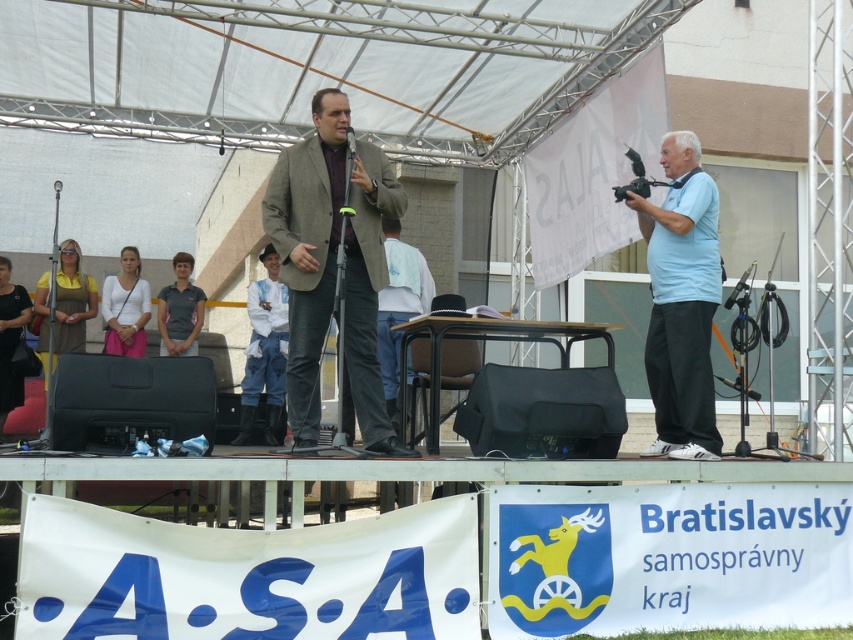
Is the position of matte brown suit at center less distant than that of metallic silver microphone at center?

Yes, it is in front of metallic silver microphone at center.

Is point (320, 305) positioned behind point (351, 136)?

Yes, it is behind point (351, 136).

Describe the element at coordinates (308, 248) in the screenshot. I see `matte brown suit at center` at that location.

I want to click on matte brown suit at center, so click(x=308, y=248).

The height and width of the screenshot is (640, 853). What do you see at coordinates (308, 248) in the screenshot?
I see `matte brown suit at center` at bounding box center [308, 248].

Is point (329, 88) positioned after point (688, 323)?

Yes.

Is point (277, 173) more distant than point (711, 236)?

That is False.

At what (x,y) coordinates should I click in order to perform the action: click on matte brown suit at center. Please return your answer as a coordinate pair (x, y). Looking at the image, I should click on (308, 248).

From the picture: Can you confirm if dark blue jersey at center is positioned above metallic silver microphone at center?

No, dark blue jersey at center is not above metallic silver microphone at center.

Does dark blue jersey at center have a lesser height compared to metallic silver microphone at center?

Incorrect, dark blue jersey at center's height does not fall short of metallic silver microphone at center's.

Image resolution: width=853 pixels, height=640 pixels. What are the coordinates of `dark blue jersey at center` in the screenshot? It's located at (180, 310).